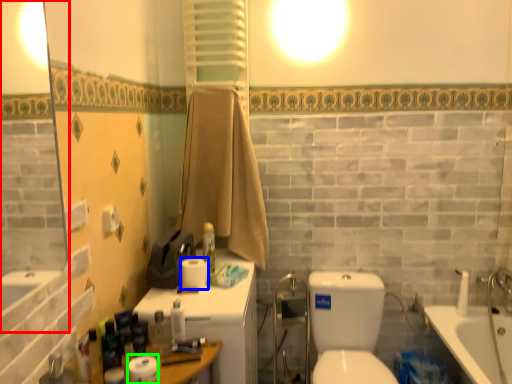
Question: Based on their relative distances, which object is nearer to mirror (highlighted by a red box)? Choose from toilet paper (highlighted by a blue box) and toilet paper (highlighted by a green box).

Choices:
 (A) toilet paper
 (B) toilet paper

Answer: (A)